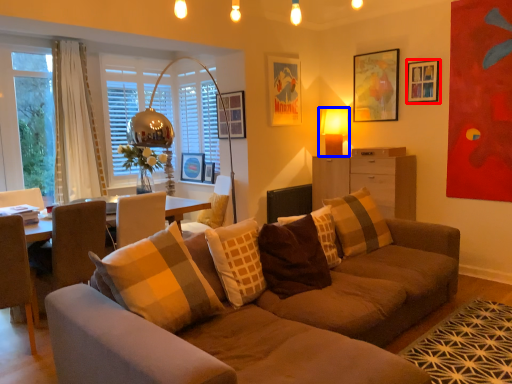
Question: Which object appears closest to the camera in this image, picture frame (highlighted by a red box) or table lamp (highlighted by a blue box)?

Choices:
 (A) picture frame
 (B) table lamp

Answer: (A)